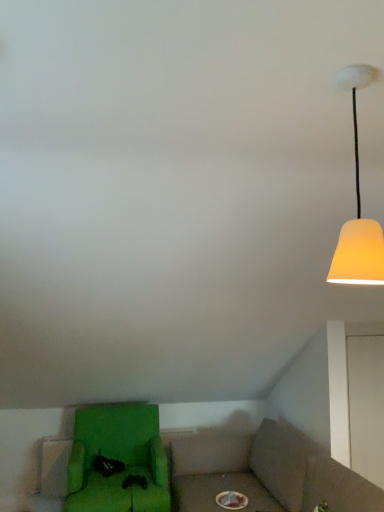
Question: Considering the positions of green fabric chair at lower left and matte yellow lampshade at upper right in the image, is green fabric chair at lower left wider or thinner than matte yellow lampshade at upper right?

Choices:
 (A) wide
 (B) thin

Answer: (A)

Question: Does point (77, 473) appear closer or farther from the camera than point (372, 265)?

Choices:
 (A) closer
 (B) farther

Answer: (B)

Question: From a real-world perspective, is green fabric chair at lower left positioned above or below matte yellow lampshade at upper right?

Choices:
 (A) above
 (B) below

Answer: (B)

Question: Considering the positions of matte yellow lampshade at upper right and green fabric chair at lower left in the image, is matte yellow lampshade at upper right bigger or smaller than green fabric chair at lower left?

Choices:
 (A) big
 (B) small

Answer: (B)

Question: From a real-world perspective, is matte yellow lampshade at upper right positioned above or below green fabric chair at lower left?

Choices:
 (A) above
 (B) below

Answer: (A)

Question: Is matte yellow lampshade at upper right taller or shorter than green fabric chair at lower left?

Choices:
 (A) tall
 (B) short

Answer: (B)

Question: Relative to green fabric chair at lower left, is matte yellow lampshade at upper right in front or behind?

Choices:
 (A) behind
 (B) front

Answer: (B)